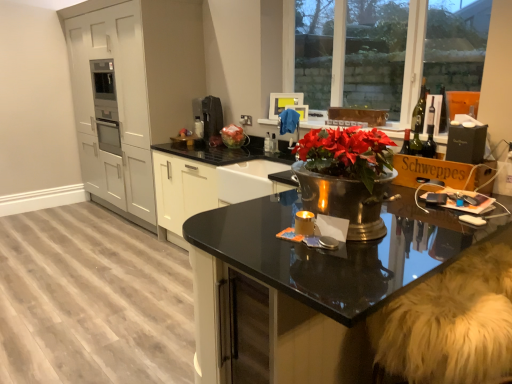
Question: Considering the positions of green glass wine bottle at upper right and clear glass window at upper right in the image, is green glass wine bottle at upper right wider or thinner than clear glass window at upper right?

Choices:
 (A) wide
 (B) thin

Answer: (A)

Question: Considering the positions of point (416, 112) and point (398, 3), is point (416, 112) closer or farther from the camera than point (398, 3)?

Choices:
 (A) farther
 (B) closer

Answer: (B)

Question: Considering the real-world distances, which object is closest to the wooden cardboard box at right?

Choices:
 (A) metallic sink at center
 (B) black glass countertop at center
 (C) satin black coffee machine at upper center
 (D) matte white cabinets at left
 (E) clear glass window at upper right

Answer: (B)

Question: Which of these objects is positioned farthest from the satin black coffee machine at upper center?

Choices:
 (A) matte white cabinets at left
 (B) metallic sink at center
 (C) black glass countertop at center
 (D) white fur swivel chair at lower right
 (E) clear glass window at upper right

Answer: (D)